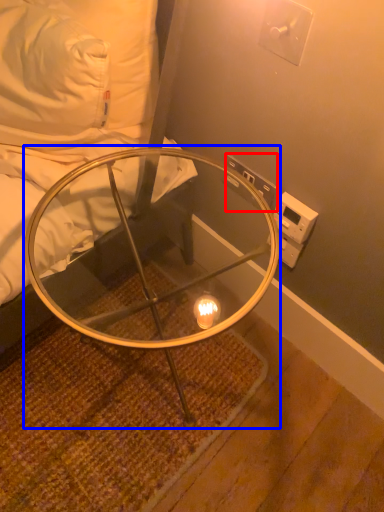
Question: Which of the following is the closest to the observer, electric outlet (highlighted by a red box) or table (highlighted by a blue box)?

Choices:
 (A) electric outlet
 (B) table

Answer: (B)